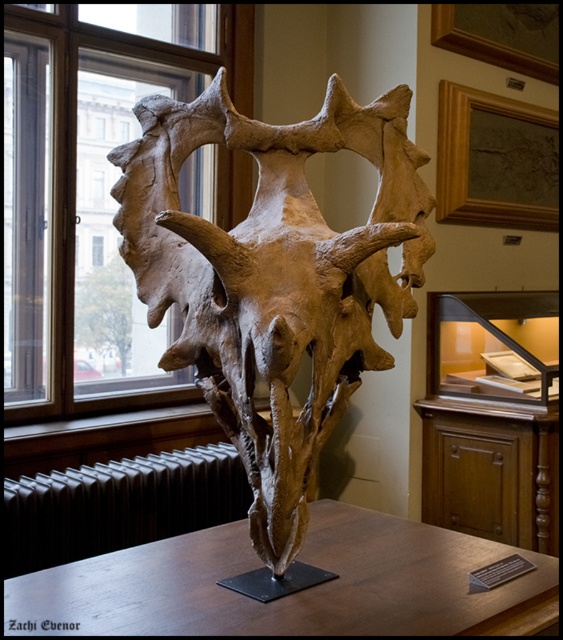
Is clear glass window at upper left above black metal radiator at lower left?

Yes.

Between clear glass window at upper left and black metal radiator at lower left, which one appears on the left side from the viewer's perspective?

clear glass window at upper left is more to the left.

At what (x,y) coordinates should I click in order to perform the action: click on clear glass window at upper left. Please return your answer as a coordinate pair (x, y). The width and height of the screenshot is (563, 640). Looking at the image, I should click on click(x=91, y=196).

Is brown bone skull at center thinner than clear glass window at upper left?

Indeed, brown bone skull at center has a lesser width compared to clear glass window at upper left.

Is point (222, 106) farther from camera compared to point (69, 52)?

No, it is in front of (69, 52).

Identify the location of brown bone skull at center. pos(274,276).

Is clear glass window at upper left below brown wooden table at center?

No, clear glass window at upper left is not below brown wooden table at center.

Is clear glass window at upper left thinner than brown wooden table at center?

Correct, clear glass window at upper left's width is less than brown wooden table at center's.

Is point (25, 388) in front of point (189, 547)?

No, (25, 388) is further to viewer.

Identify the location of clear glass window at upper left. (91, 196).